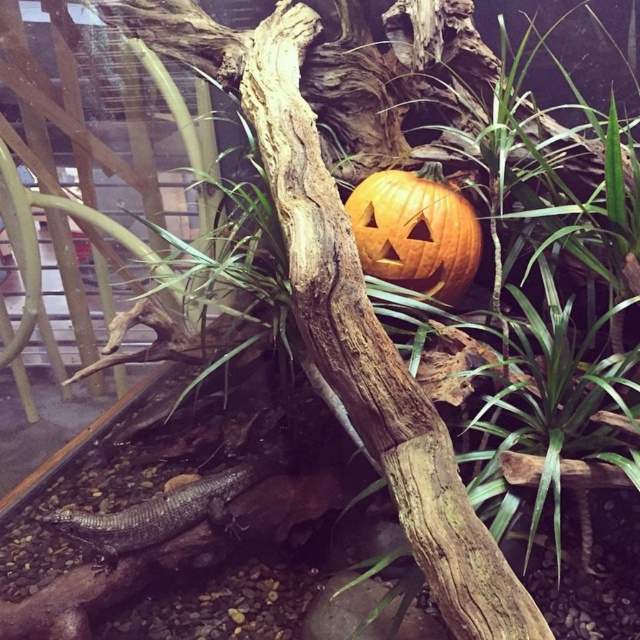
Question: Does orange matte pumpkin at center appear under shiny dark gray lizard at lower left?

Choices:
 (A) yes
 (B) no

Answer: (B)

Question: Does orange matte pumpkin at center have a lesser width compared to shiny dark gray lizard at lower left?

Choices:
 (A) no
 (B) yes

Answer: (B)

Question: Which point is closer to the camera?

Choices:
 (A) orange matte pumpkin at center
 (B) shiny dark gray lizard at lower left

Answer: (B)

Question: Where is orange matte pumpkin at center located in relation to shiny dark gray lizard at lower left in the image?

Choices:
 (A) left
 (B) right

Answer: (B)